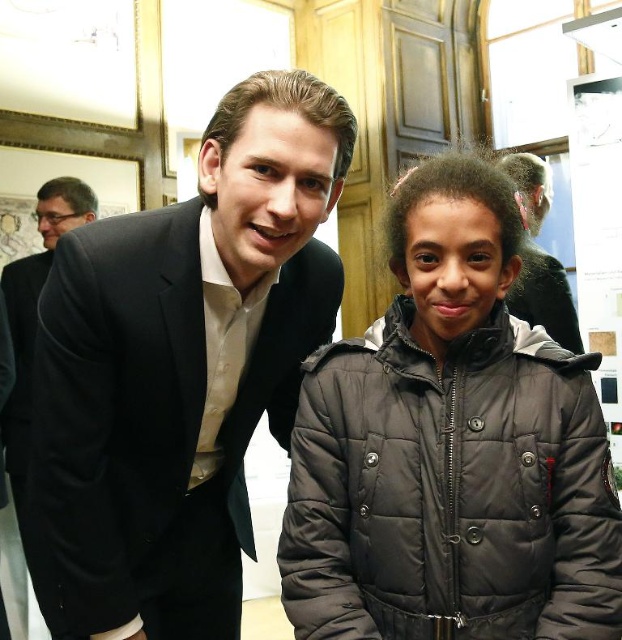
Question: Can you confirm if dark gray puffer jacket at center is positioned to the right of black suit at left?

Choices:
 (A) yes
 (B) no

Answer: (A)

Question: Which of the following is the farthest from the observer?

Choices:
 (A) dark gray puffer jacket at center
 (B) matte black suit at center
 (C) black satin suit at left

Answer: (B)

Question: In this image, where is black satin suit at left located relative to dark gray puffer jacket at center?

Choices:
 (A) left
 (B) right

Answer: (A)

Question: Is dark gray puffer jacket at center behind black suit at left?

Choices:
 (A) no
 (B) yes

Answer: (A)

Question: Which of the following is the farthest from the observer?

Choices:
 (A) (210, 316)
 (B) (555, 282)
 (C) (14, 353)
 (D) (388, 497)

Answer: (C)

Question: Considering the real-world distances, which object is closest to the black satin suit at left?

Choices:
 (A) matte black suit at center
 (B) dark gray puffer jacket at center

Answer: (B)